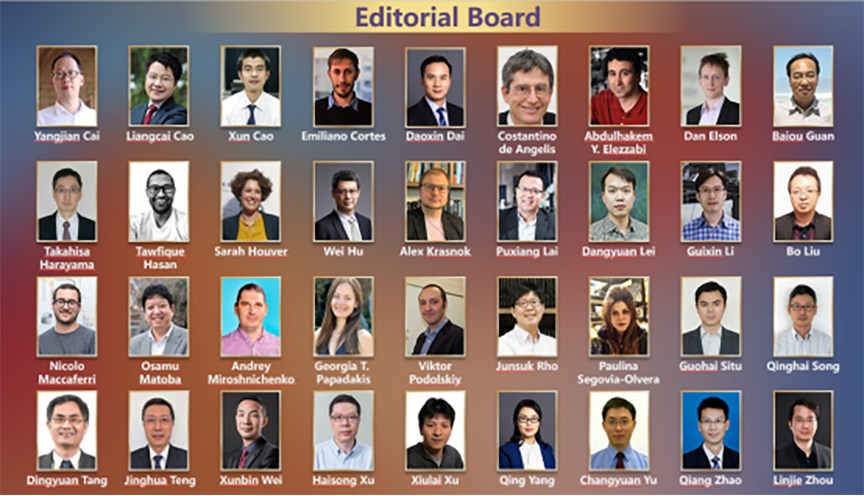
You are a GUI agent. You are given a task and a screenshot of the screen. Output one action in this format:
    pyautogui.click(x=<x>, y=<y>)
    Task: Click on the photos on bottom row
    The height and width of the screenshot is (496, 864).
    Given the screenshot: What is the action you would take?
    pyautogui.click(x=67, y=443), pyautogui.click(x=140, y=416), pyautogui.click(x=234, y=425), pyautogui.click(x=342, y=431), pyautogui.click(x=445, y=449), pyautogui.click(x=502, y=450), pyautogui.click(x=598, y=455), pyautogui.click(x=676, y=456), pyautogui.click(x=804, y=459)